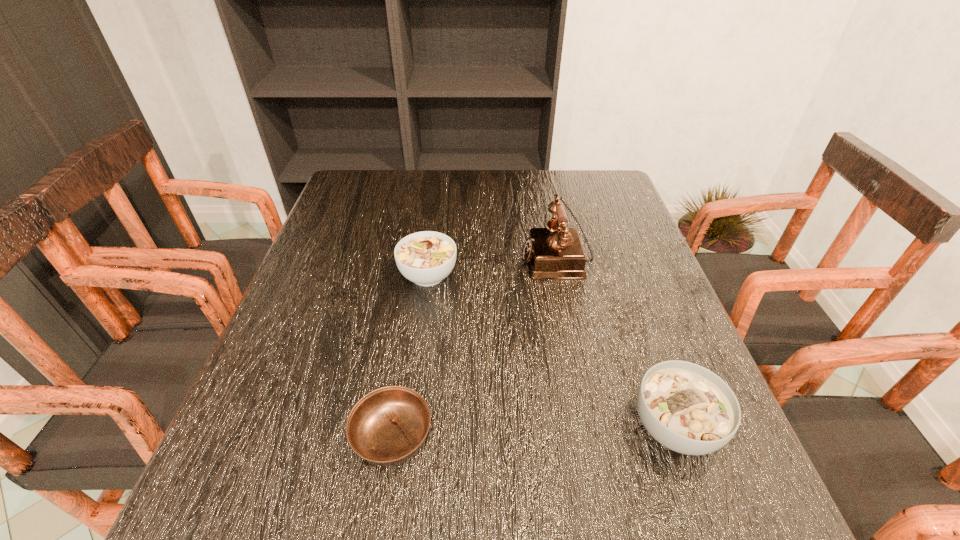
You are a GUI agent. You are given a task and a screenshot of the screen. Output one action in this format:
    pyautogui.click(x=<x>, y=<y>)
    Task: Click on the telephone that is at the right edge
    Image resolution: width=960 pixels, height=540 pixels.
    Given the screenshot: What is the action you would take?
    pyautogui.click(x=556, y=252)

Locate an element on the screen. The height and width of the screenshot is (540, 960). soup bowl at the right edge is located at coordinates (x=687, y=408).

This screenshot has width=960, height=540. Identify the location of free space at the far edge of the desktop. (539, 183).

The image size is (960, 540). In order to click on free space at the near edge of the desktop in this screenshot , I will do `click(526, 539)`.

I want to click on vacant space at the left edge of the desktop, so click(x=293, y=310).

In the image, there is a desktop. Where is `blank space at the right edge`? The width and height of the screenshot is (960, 540). blank space at the right edge is located at coordinates (631, 308).

Where is `vacant space at the far left corner of the desktop`? Image resolution: width=960 pixels, height=540 pixels. vacant space at the far left corner of the desktop is located at coordinates (375, 180).

This screenshot has height=540, width=960. I want to click on free location at the far right corner of the desktop, so (x=602, y=184).

This screenshot has height=540, width=960. What are the coordinates of `free space between the telephone and the shortest object` in the screenshot? It's located at (474, 347).

What are the coordinates of `vacant area that lies between the farthest soup bowl and the rightmost soup bowl` in the screenshot? It's located at click(551, 351).